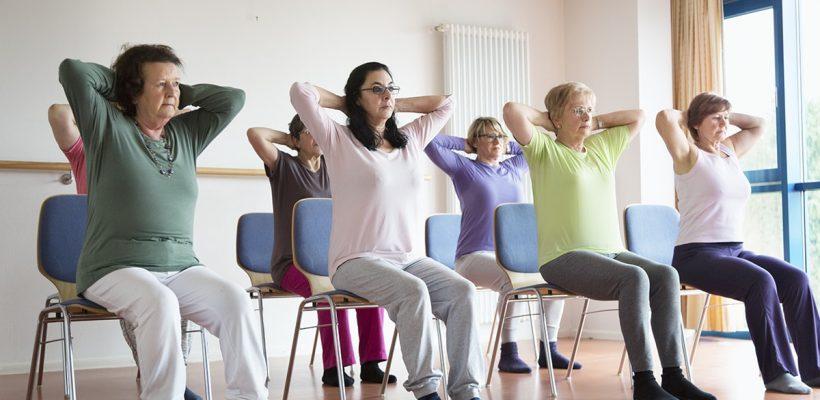
This screenshot has height=400, width=820. I want to click on chairs, so click(x=640, y=221), click(x=524, y=225), click(x=449, y=234), click(x=294, y=229), click(x=243, y=238), click(x=57, y=250).